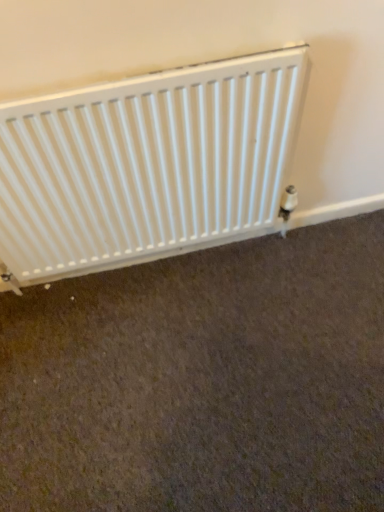
The height and width of the screenshot is (512, 384). I want to click on vacant area that is in front of white matte radiator at center, so click(x=169, y=375).